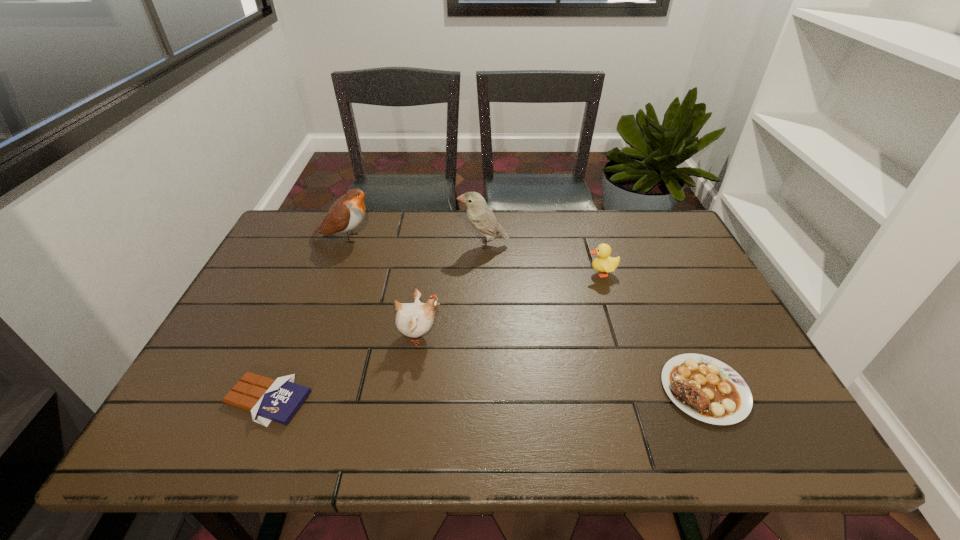
Find the location of a particular element. This screenshot has height=540, width=960. the third object from right to left is located at coordinates (481, 217).

Find the location of a particular element. The image size is (960, 540). the leftmost bird is located at coordinates (346, 213).

Locate an element on the screen. This screenshot has width=960, height=540. the fourth object from right to left is located at coordinates (412, 319).

I want to click on the nearest bird, so click(x=412, y=319).

This screenshot has height=540, width=960. I want to click on the fifth object from left to right, so click(604, 262).

Locate an element on the screen. The height and width of the screenshot is (540, 960). duckling is located at coordinates (604, 262).

I want to click on steak, so click(705, 388).

Image resolution: width=960 pixels, height=540 pixels. I want to click on the rightmost object, so click(705, 388).

Find the location of a particular element. The image size is (960, 540). chocolate bar is located at coordinates pyautogui.click(x=267, y=399).

This screenshot has width=960, height=540. I want to click on free region located at the face of the third object from right to left, so click(x=381, y=244).